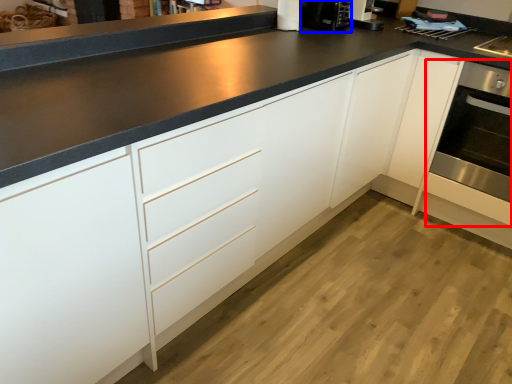
Question: Which object is closer to the camera taking this photo, oven (highlighted by a red box) or coffee machine (highlighted by a blue box)?

Choices:
 (A) oven
 (B) coffee machine

Answer: (A)